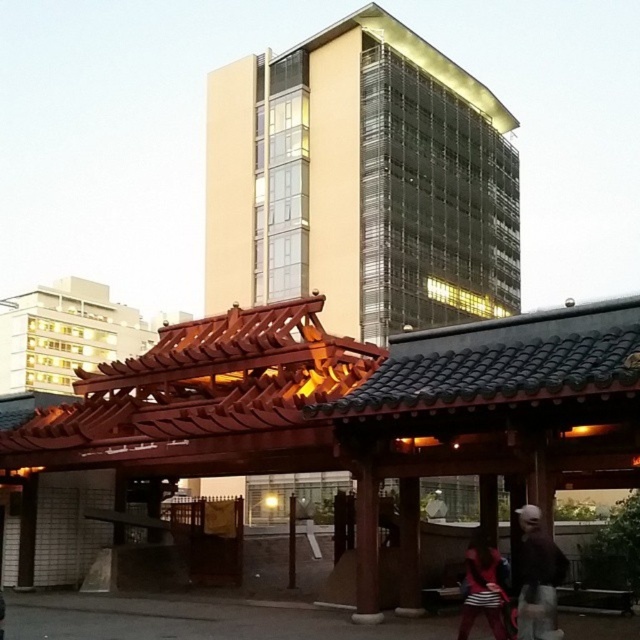
Between beige glass building at upper center and dark brown leather jacket at lower right, which one is positioned lower?

Positioned lower is dark brown leather jacket at lower right.

The width and height of the screenshot is (640, 640). I want to click on beige glass building at upper center, so click(x=362, y=182).

Consider the image. Who is higher up, beige glass building at upper center or striped fabric bag at lower right?

beige glass building at upper center is above.

Can you confirm if beige glass building at upper center is shorter than striped fabric bag at lower right?

In fact, beige glass building at upper center may be taller than striped fabric bag at lower right.

Describe the element at coordinates (362, 182) in the screenshot. Image resolution: width=640 pixels, height=640 pixels. I see `beige glass building at upper center` at that location.

Where is `beige glass building at upper center`? beige glass building at upper center is located at coordinates (362, 182).

Can you confirm if dark brown leather jacket at lower right is bigger than striped fabric bag at lower right?

Indeed, dark brown leather jacket at lower right has a larger size compared to striped fabric bag at lower right.

Which is below, dark brown leather jacket at lower right or striped fabric bag at lower right?

striped fabric bag at lower right is lower down.

Between point (547, 540) and point (472, 541), which one is positioned behind?

Positioned behind is point (472, 541).

Locate an element on the screen. This screenshot has width=640, height=640. dark brown leather jacket at lower right is located at coordinates (538, 577).